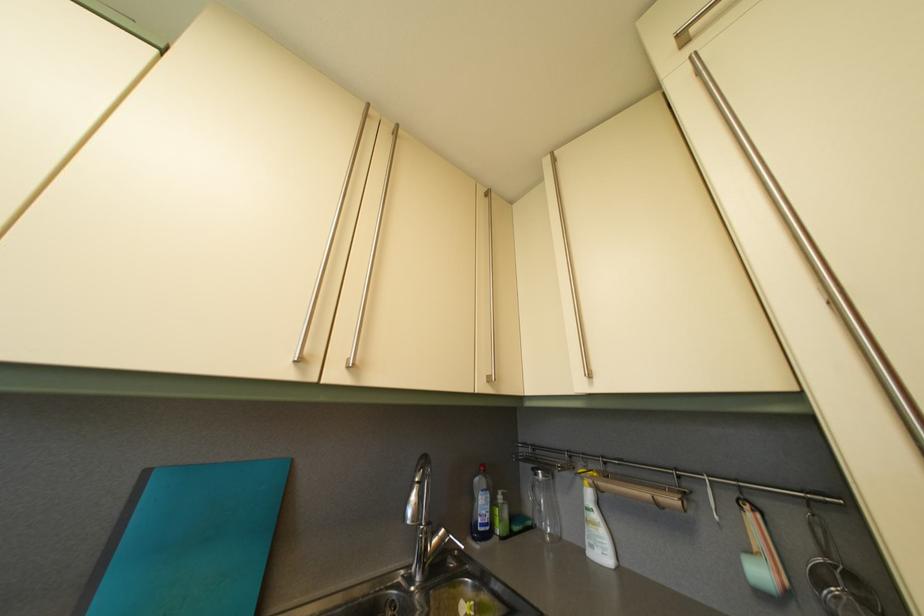
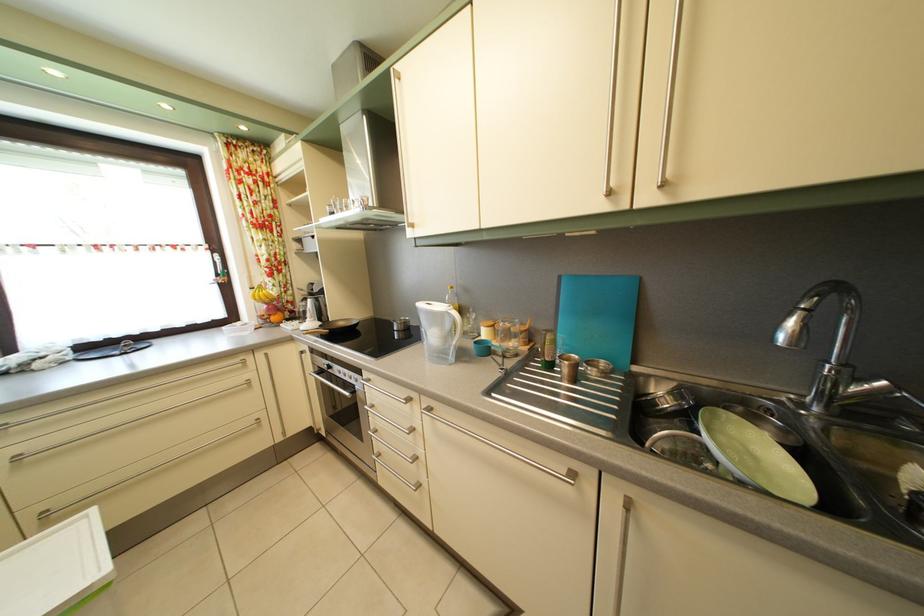
Question: I am providing you with two images of the same scene from different viewpoints. Please identify which objects are invisible in image2.

Choices:
 (A) faucet handle
 (B) white water pitcher
 (C) metal cabinet handle
 (D) none of these

Answer: (D)